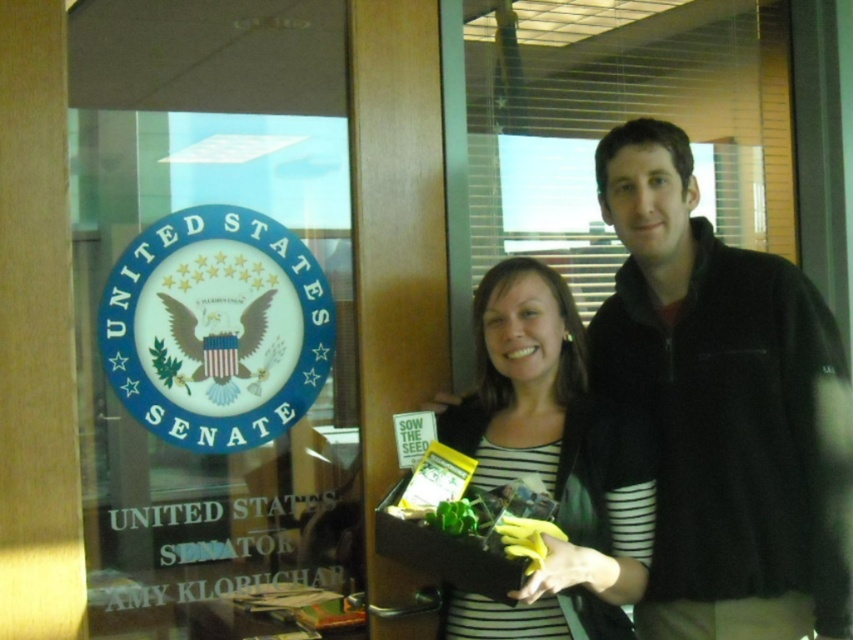
Question: Can you confirm if transparent glass at upper left is positioned to the right of black fleece jacket at center?

Choices:
 (A) yes
 (B) no

Answer: (B)

Question: Which object is positioned closest to the transparent glass at upper left?

Choices:
 (A) black fleece jacket at center
 (B) striped fabric at center

Answer: (B)

Question: Which object is closer to the camera taking this photo?

Choices:
 (A) black fleece jacket at center
 (B) striped fabric at center
 (C) transparent glass at upper left

Answer: (B)

Question: Observing the image, what is the correct spatial positioning of transparent glass at upper left in reference to black fleece jacket at center?

Choices:
 (A) left
 (B) right

Answer: (A)

Question: Considering the relative positions of transparent glass at upper left and black fleece jacket at center in the image provided, where is transparent glass at upper left located with respect to black fleece jacket at center?

Choices:
 (A) above
 (B) below

Answer: (A)

Question: Estimate the real-world distances between objects in this image. Which object is farther from the transparent glass at upper left?

Choices:
 (A) black fleece jacket at center
 (B) striped fabric at center

Answer: (A)